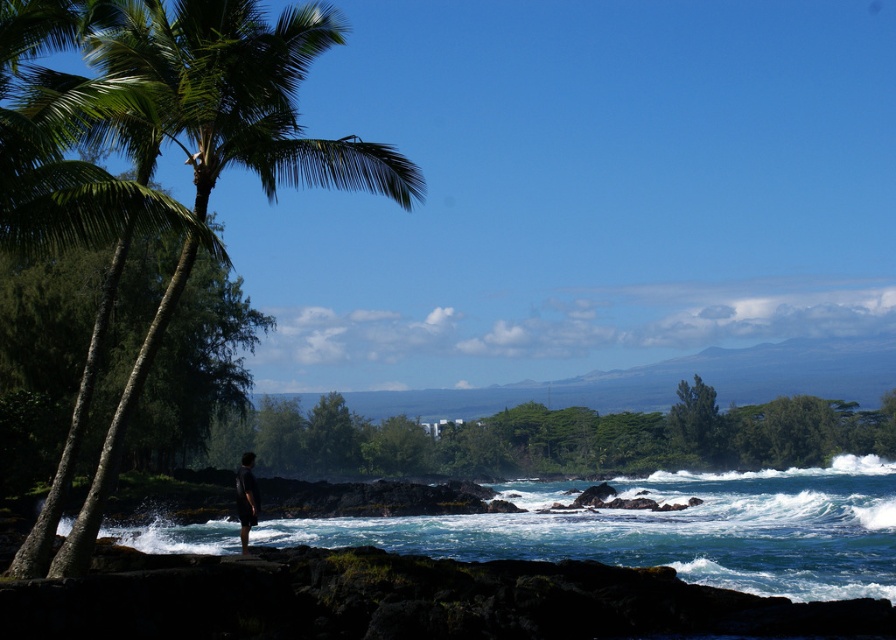
Question: Which object appears farthest from the camera in this image?

Choices:
 (A) dark gray shorts at center
 (B) blue water at center

Answer: (B)

Question: Which object appears farthest from the camera in this image?

Choices:
 (A) blue water at center
 (B) green leafy palm tree at left

Answer: (A)

Question: Based on their relative distances, which object is farther from the green leafy palm tree at left?

Choices:
 (A) blue water at center
 (B) dark gray shorts at center

Answer: (A)

Question: Is blue water at center wider than green leafy palm tree at left?

Choices:
 (A) yes
 (B) no

Answer: (A)

Question: Does blue water at center appear on the right side of green leafy palm tree at left?

Choices:
 (A) yes
 (B) no

Answer: (A)

Question: Does blue water at center appear on the left side of dark gray shorts at center?

Choices:
 (A) yes
 (B) no

Answer: (B)